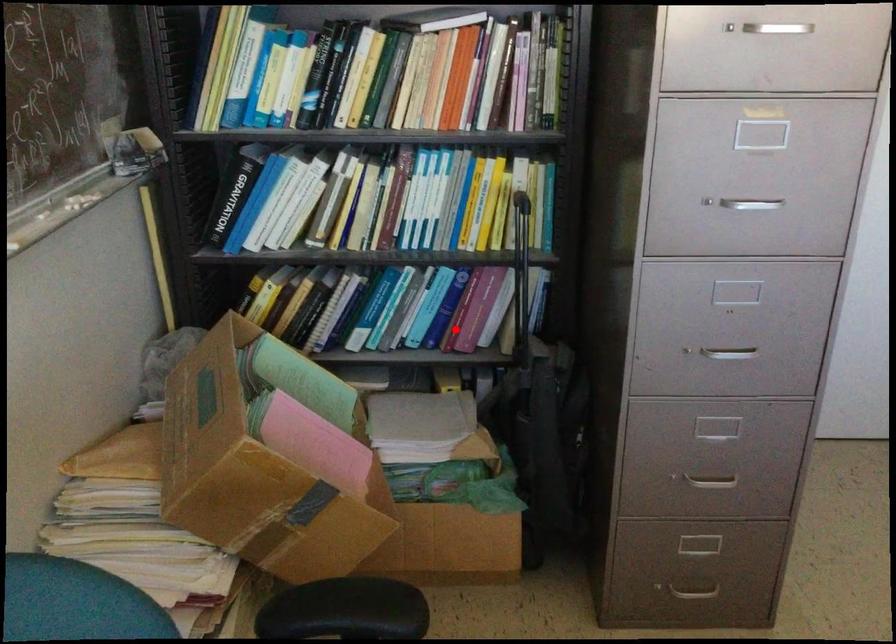
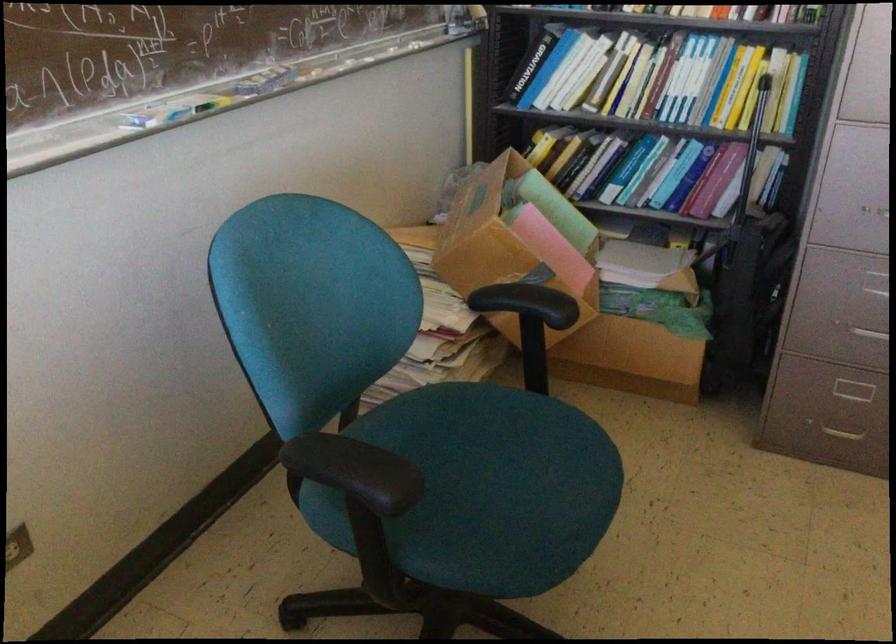
In the second image, find the point that corresponds to the highlighted location in the first image.

(692, 194)